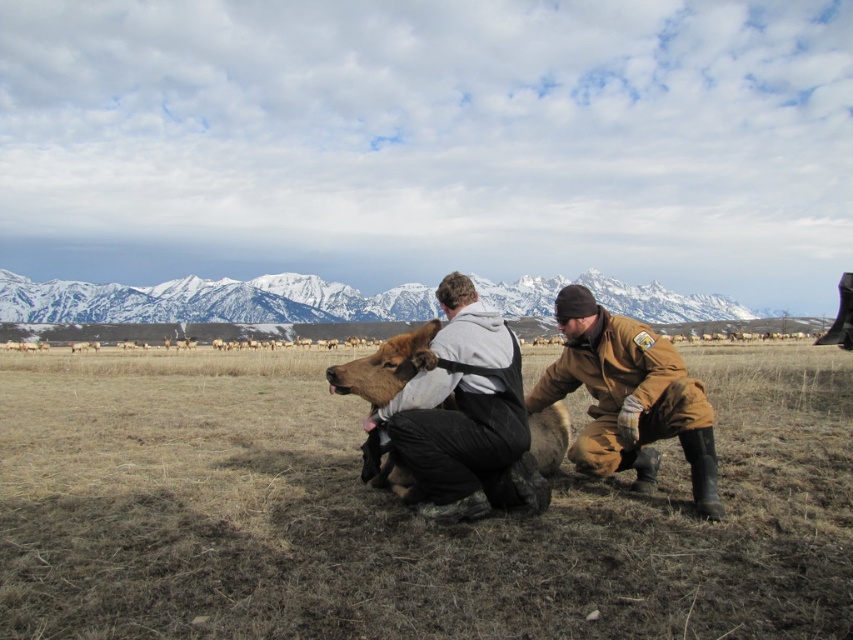
Is brown dry grass at center thinner than brown leather jacket at lower right?

In fact, brown dry grass at center might be wider than brown leather jacket at lower right.

Between brown dry grass at center and brown leather jacket at lower right, which one appears on the right side from the viewer's perspective?

brown leather jacket at lower right is more to the right.

Between point (792, 355) and point (550, 380), which one is positioned in front?

Point (550, 380) is in front.

The width and height of the screenshot is (853, 640). Identify the location of brown dry grass at center. (399, 513).

Is dark brown fur at center to the left of brown leather jacket at lower right from the viewer's perspective?

Correct, you'll find dark brown fur at center to the left of brown leather jacket at lower right.

Between dark brown fur at center and brown leather jacket at lower right, which one is positioned lower?

brown leather jacket at lower right is below.

Is point (430, 348) closer to camera compared to point (653, 420)?

That is False.

The height and width of the screenshot is (640, 853). What are the coordinates of `dark brown fur at center` in the screenshot? It's located at (463, 417).

Between point (782, 461) and point (479, 500), which one is positioned behind?

Positioned behind is point (782, 461).

Is brown dry grass at center smaller than dark brown fur at center?

No.

Does point (434, 528) come farther from viewer compared to point (524, 451)?

No, it is not.

Where is `brown dry grass at center`? brown dry grass at center is located at coordinates (399, 513).